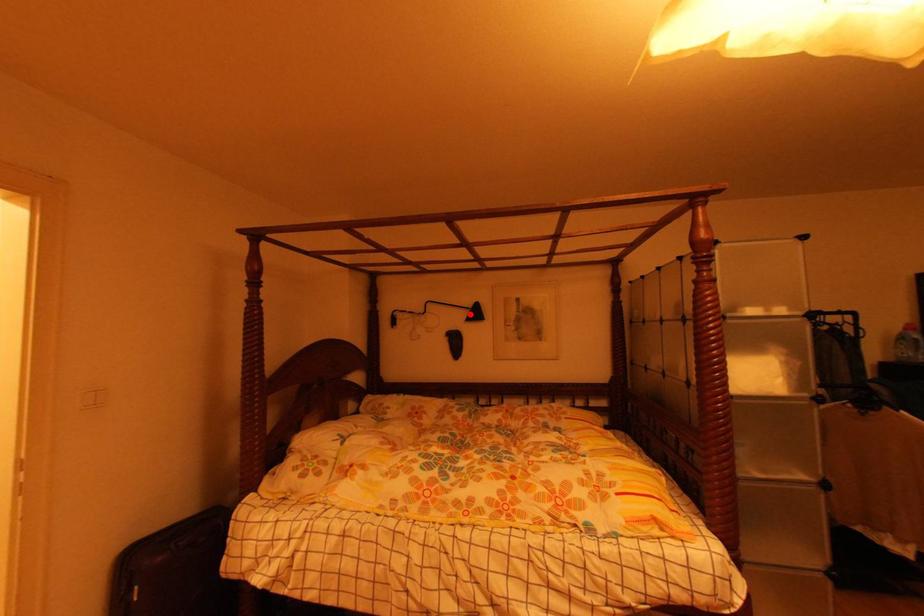
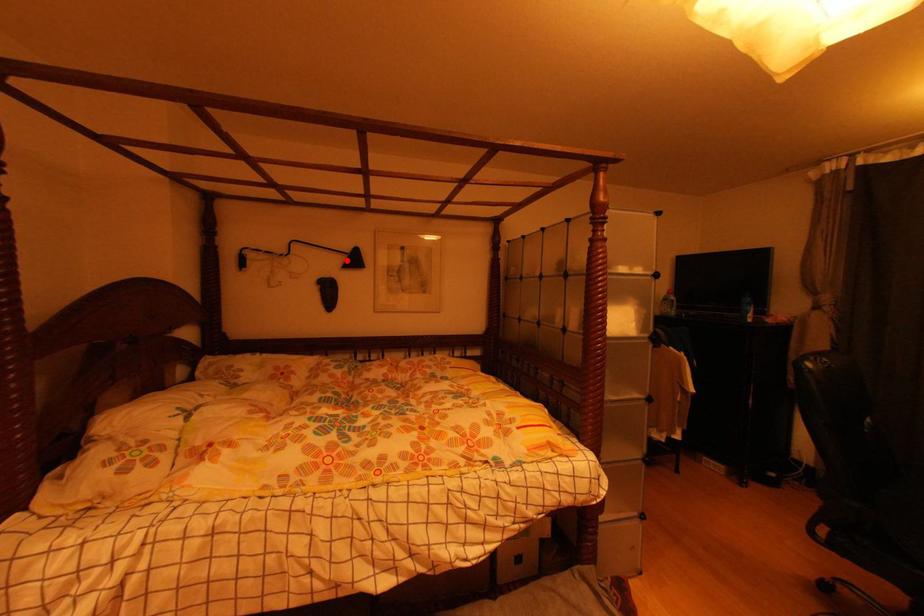
I am providing you with two images of the same scene from different viewpoints. A red point is marked on the first image and another point is marked on the second image. Does the point marked in image1 correspond to the same location as the one in image2?

Yes